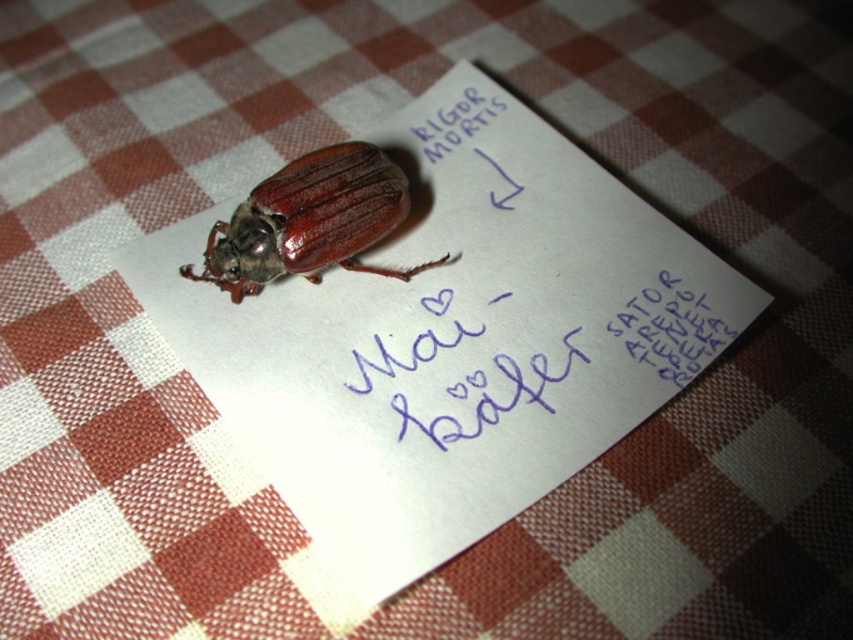
You are standing in a room and see the shiny brown beetle at center on a checkered tablecloth. If you want to reach it without moving your feet, is it within your arm reach?

The shiny brown beetle at center is 4.24 feet from viewer, which is approximately 45 inches. The average human arm reach is about 24 to 30 inches, so it is out of arm reach.

You are an entomologist examining the scene. You need to determine if the shiny brown beetle at center can fit entirely on the black paper at upper center. Based on their sizes, can it fit?

The shiny brown beetle at center is wider than the black paper at upper center, so it cannot fit entirely on the black paper at upper center.

You are an archaeologist examining the paper. You notice the blue ink writing at center and the black paper at upper center. Which object is closer to you?

The black paper at upper center is closer to you because it is positioned over the blue ink writing at center.